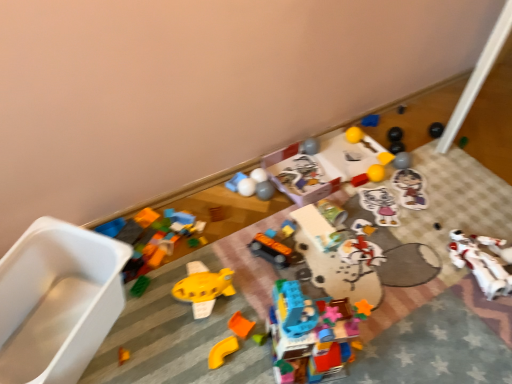
Locate an element on the screen. vacant space situated on the left part of orange matte block at center, which is the thirteenth toy from right to left is located at coordinates (187, 330).